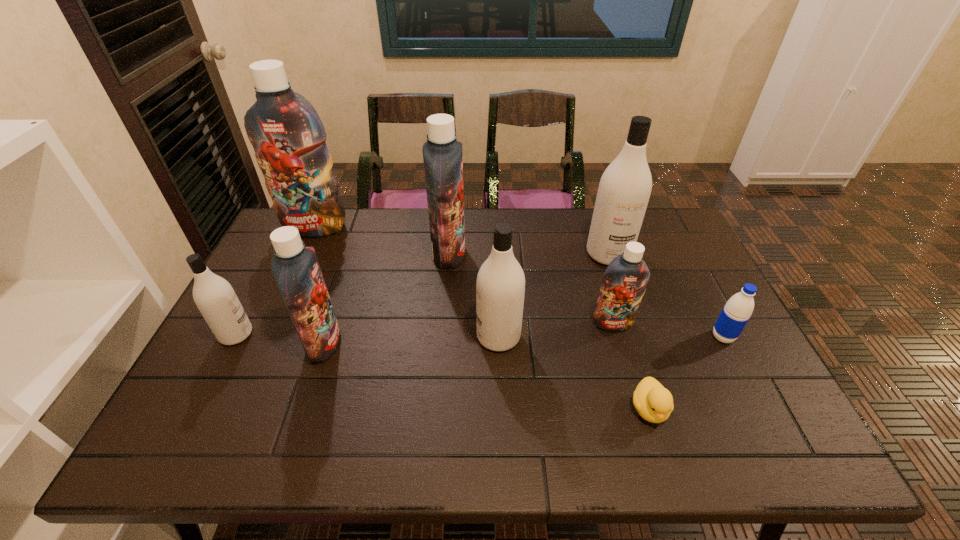
I want to click on free point between the farthest white shampoo and the second white shampoo from left to right, so click(x=553, y=295).

Where is `empty space that is in between the second white shampoo from left to right and the tallest object`? empty space that is in between the second white shampoo from left to right and the tallest object is located at coordinates (407, 282).

Choose which object is the fourth nearest neighbor to the second white shampoo from left to right. Please provide its 2D coordinates. Your answer should be formatted as a tuple, i.e. [(x, y)], where the tuple contains the x and y coordinates of a point satisfying the conditions above.

[(624, 190)]

Select which object appears as the seventh closest to the rightmost blue shampoo. Please provide its 2D coordinates. Your answer should be formatted as a tuple, i.e. [(x, y)], where the tuple contains the x and y coordinates of a point satisfying the conditions above.

[(289, 139)]

Locate an element on the screen. shampoo that is the sixth closest one to the tallest shampoo is located at coordinates (624, 283).

Where is `the closest shampoo to the blue water bottle`? the closest shampoo to the blue water bottle is located at coordinates (624, 283).

This screenshot has height=540, width=960. Find the location of `the closest blue shampoo to the shortest object`. the closest blue shampoo to the shortest object is located at coordinates (624, 283).

Identify the location of blue shampoo object that ranks as the fourth closest to the duck. (289, 139).

This screenshot has height=540, width=960. I want to click on white shampoo identified as the closest to the duck, so click(x=500, y=285).

Locate which white shampoo is the closest to the nearest object. Please provide its 2D coordinates. Your answer should be formatted as a tuple, i.e. [(x, y)], where the tuple contains the x and y coordinates of a point satisfying the conditions above.

[(500, 285)]